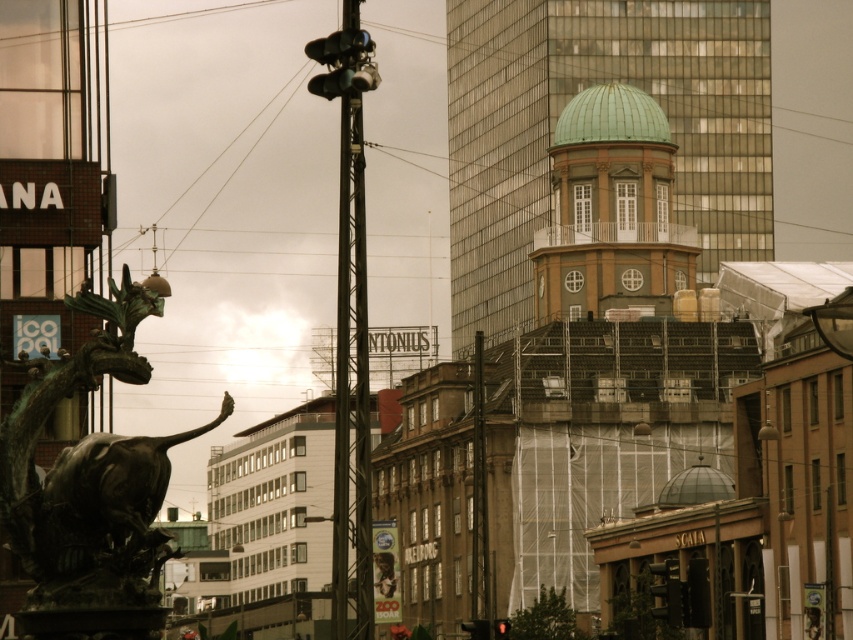
Is green glass dome at upper center to the right of green copper dome at upper center from the viewer's perspective?

Correct, you'll find green glass dome at upper center to the right of green copper dome at upper center.

Is green glass dome at upper center to the left of green copper dome at upper center from the viewer's perspective?

Incorrect, green glass dome at upper center is not on the left side of green copper dome at upper center.

Does point (450, 12) come closer to viewer compared to point (647, 132)?

No, it is behind (647, 132).

Where is `green glass dome at upper center`? This screenshot has height=640, width=853. green glass dome at upper center is located at coordinates (563, 106).

Can you confirm if green patina bronze bull at lower left is positioned to the right of green copper dome at upper center?

Incorrect, green patina bronze bull at lower left is not on the right side of green copper dome at upper center.

Is green patina bronze bull at lower left shorter than green copper dome at upper center?

Yes.

Does point (67, 620) come in front of point (613, 182)?

Yes.

Image resolution: width=853 pixels, height=640 pixels. I want to click on green patina bronze bull at lower left, so click(90, 490).

Who is positioned more to the left, green glass dome at upper center or green patina bronze bull at lower left?

From the viewer's perspective, green patina bronze bull at lower left appears more on the left side.

What do you see at coordinates (563, 106) in the screenshot?
I see `green glass dome at upper center` at bounding box center [563, 106].

Find the location of a particular element. green glass dome at upper center is located at coordinates (563, 106).